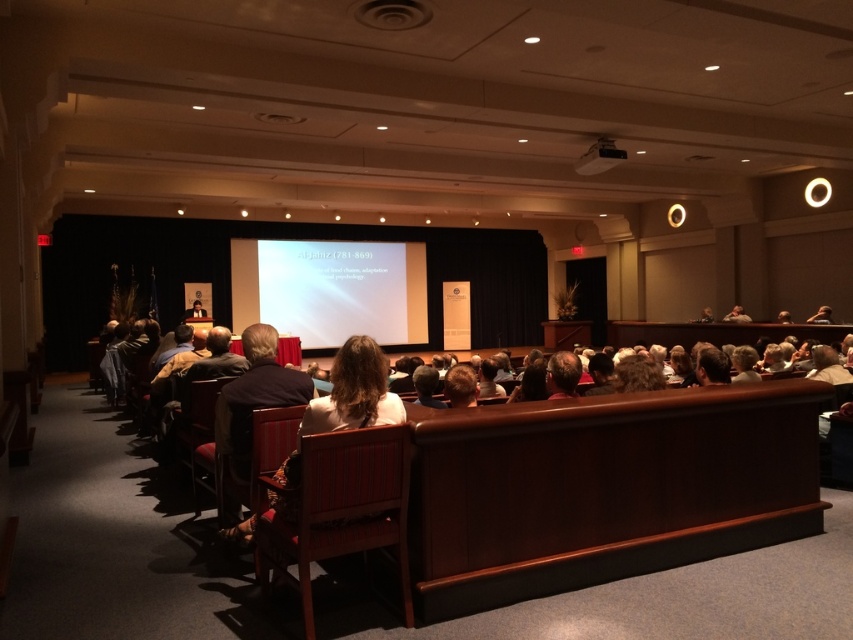
Question: Can you confirm if white matte projection screen at center is bigger than white fabric chair at center?

Choices:
 (A) no
 (B) yes

Answer: (B)

Question: Which point is farther to the camera?

Choices:
 (A) (281, 566)
 (B) (292, 332)
 (C) (403, 410)

Answer: (B)

Question: From the image, what is the correct spatial relationship of wooden chair at center in relation to white matte projection screen at center?

Choices:
 (A) left
 (B) right

Answer: (B)

Question: Among these points, which one is nearest to the camera?

Choices:
 (A) (339, 545)
 (B) (618, 156)
 (C) (364, 250)

Answer: (A)

Question: Can you confirm if wooden chair at center is thinner than white matte projection screen at center?

Choices:
 (A) no
 (B) yes

Answer: (B)

Question: Which of the following is the farthest from the observer?

Choices:
 (A) wooden chair at center
 (B) white matte projection screen at center

Answer: (B)